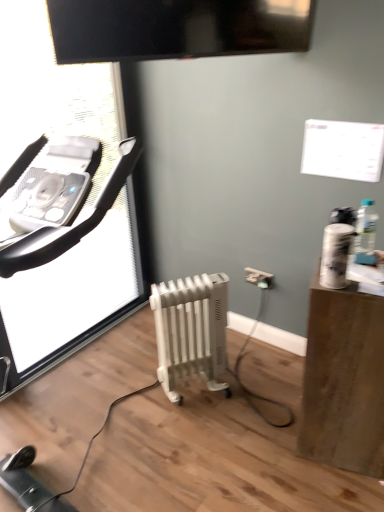
Locate an element on the screen. vacant space that is to the left of white plastic radiator at center is located at coordinates (134, 405).